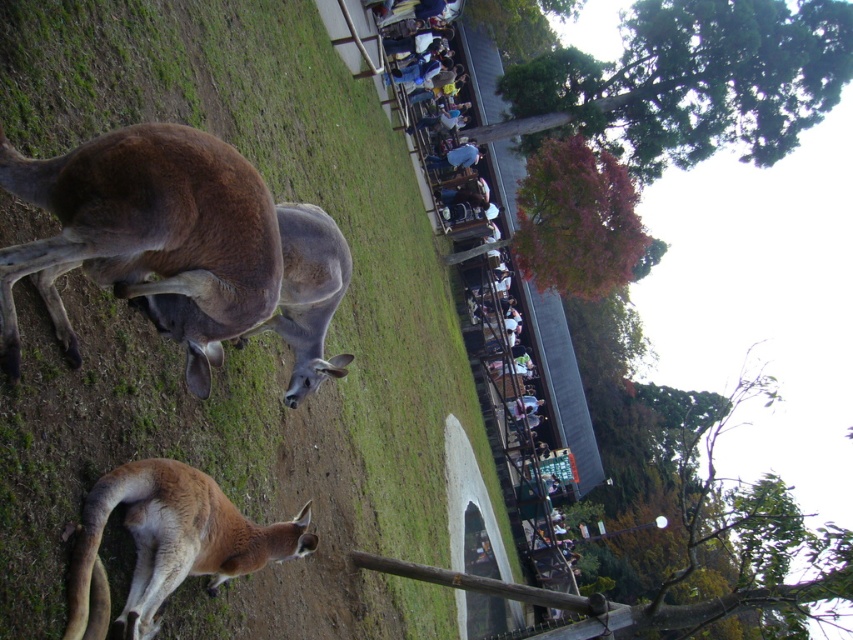
Is brown furry kangaroo at center below brown fur kangaroo at center?

No, brown furry kangaroo at center is not below brown fur kangaroo at center.

Is point (64, 344) farther from viewer compared to point (318, 378)?

No, it is in front of (318, 378).

Find the location of a particular element. brown furry kangaroo at center is located at coordinates (148, 234).

Is brown furry kangaroo at center closer to camera compared to light brown fur at center?

Yes, brown furry kangaroo at center is closer to the viewer.

Is point (144, 276) positioned in front of point (531, 532)?

Yes, point (144, 276) is closer to viewer.

Which is behind, point (132, 145) or point (509, 211)?

The point (509, 211) is more distant.

The height and width of the screenshot is (640, 853). I want to click on brown furry kangaroo at center, so click(x=148, y=234).

Looking at this image, is green grass at lower left taller than brown furry kangaroo at center?

Correct, green grass at lower left is much taller as brown furry kangaroo at center.

Which is in front, point (78, 460) or point (96, 186)?

Positioned in front is point (96, 186).

This screenshot has width=853, height=640. I want to click on green grass at lower left, so click(x=250, y=339).